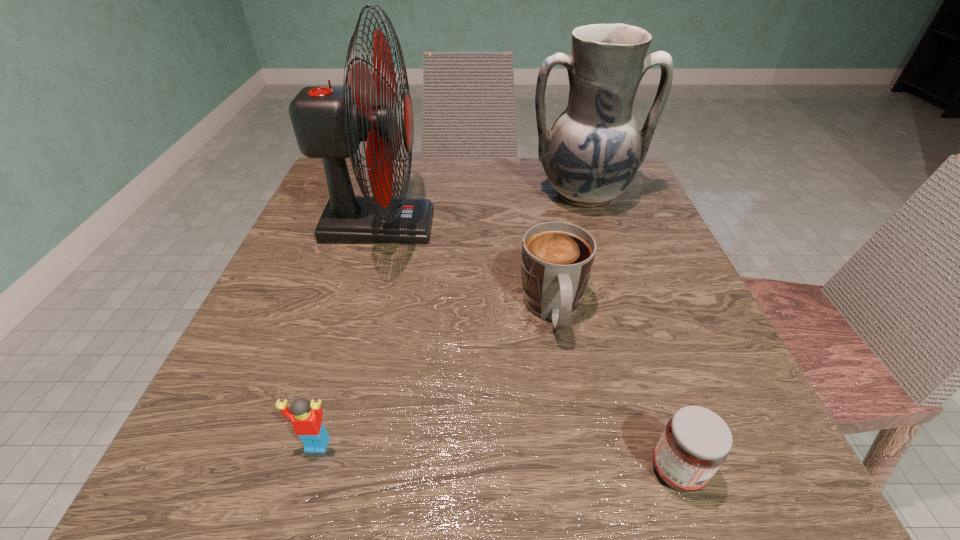
Identify the location of object that is at the near right corner. This screenshot has width=960, height=540. [x=696, y=441].

In the image, there is a desktop. Identify the location of free region at the far edge. The width and height of the screenshot is (960, 540). (507, 170).

This screenshot has height=540, width=960. What are the coordinates of `vacant position at the near edge of the desktop` in the screenshot? It's located at tap(401, 441).

Image resolution: width=960 pixels, height=540 pixels. Identify the location of vacant area at the left edge. (357, 271).

In order to click on free region at the right edge of the desktop in this screenshot , I will do `click(684, 275)`.

Find the location of a particular element. Image resolution: width=960 pixels, height=540 pixels. empty space between the jam and the pitcher is located at coordinates (631, 332).

The height and width of the screenshot is (540, 960). What are the coordinates of `empty space that is in between the mug and the Lego` in the screenshot? It's located at coord(435,377).

Where is `vacant point located between the tallest object and the Lego`? vacant point located between the tallest object and the Lego is located at coordinates (348, 335).

You are a GUI agent. You are given a task and a screenshot of the screen. Output one action in this format:
    pyautogui.click(x=<x>, y=<y>)
    Task: Click on the free area in between the Lego and the jam
    
    Given the screenshot: What is the action you would take?
    pyautogui.click(x=497, y=457)

Where is `free space between the Lego and the mug`? The height and width of the screenshot is (540, 960). free space between the Lego and the mug is located at coordinates (435, 377).